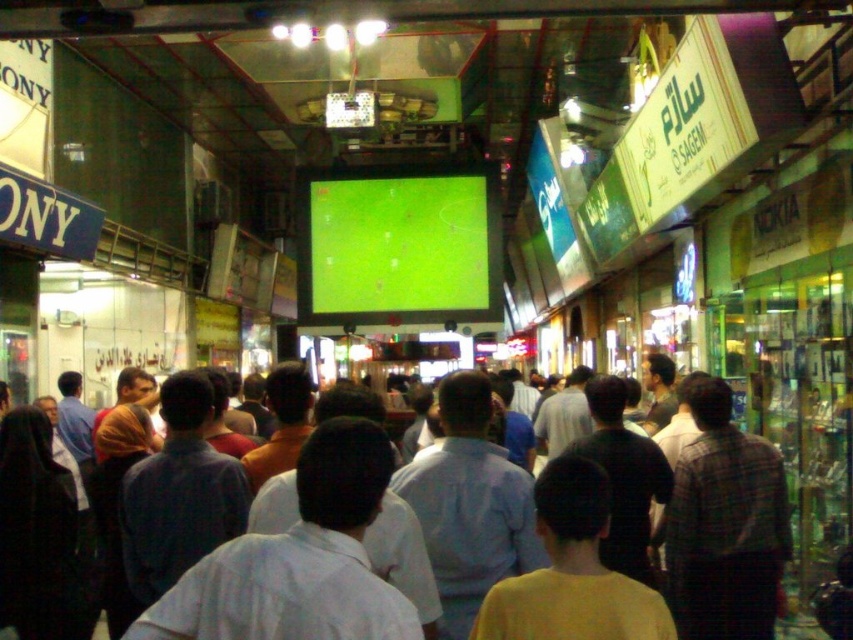
Who is higher up, green matte screen at center or light blue shirt at center?

green matte screen at center

Is point (358, 192) in front of point (370, 404)?

No, (358, 192) is behind (370, 404).

Image resolution: width=853 pixels, height=640 pixels. I want to click on green matte screen at center, so click(398, 244).